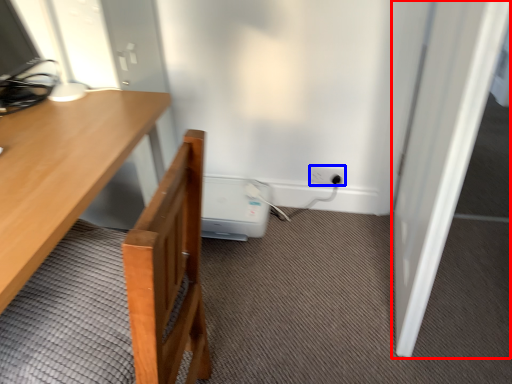
Question: Among these objects, which one is nearest to the camera, door (highlighted by a red box) or electric outlet (highlighted by a blue box)?

Choices:
 (A) door
 (B) electric outlet

Answer: (A)